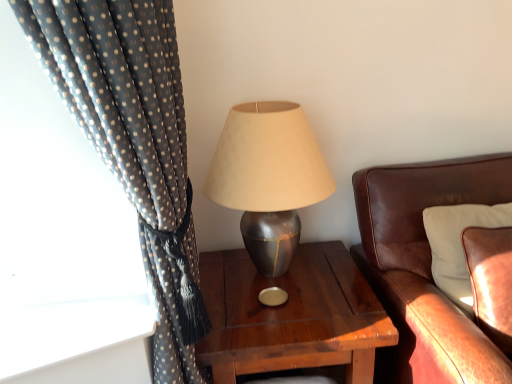
I want to click on polka dot fabric curtain at left, so click(134, 143).

Identify the location of metallic gray lamp at center. This screenshot has width=512, height=384. (268, 178).

From a real-world perspective, does brown leather couch at right sit lower than wooden nightstand at center?

Actually, brown leather couch at right is physically above wooden nightstand at center in the real world.

Based on the photo, from the image's perspective, is brown leather couch at right on top of wooden nightstand at center?

Correct, brown leather couch at right appears higher than wooden nightstand at center in the image.

Does brown leather couch at right have a larger size compared to wooden nightstand at center?

Correct, brown leather couch at right is larger in size than wooden nightstand at center.

Is brown leather couch at right placed right next to wooden nightstand at center?

No, brown leather couch at right is not making contact with wooden nightstand at center.

At what (x,y) coordinates should I click in order to perform the action: click on studio couch in front of the metallic gray lamp at center. Please return your answer as a coordinate pair (x, y). The width and height of the screenshot is (512, 384). Looking at the image, I should click on (425, 268).

Is metallic gray lamp at center in contact with brown leather couch at right?

No, metallic gray lamp at center is not in contact with brown leather couch at right.

From the image's perspective, is metallic gray lamp at center located above brown leather couch at right?

Correct, metallic gray lamp at center appears higher than brown leather couch at right in the image.

Consider the image. Could you tell me if brown leather couch at right is turned towards polka dot fabric curtain at left?

No, brown leather couch at right is not aimed at polka dot fabric curtain at left.

Can you tell me how much brown leather couch at right and polka dot fabric curtain at left differ in facing direction?

2.69 degrees separate the facing orientations of brown leather couch at right and polka dot fabric curtain at left.

Does brown leather couch at right have a larger size compared to polka dot fabric curtain at left?

Yes, brown leather couch at right is bigger than polka dot fabric curtain at left.

Does brown leather couch at right appear on the right side of polka dot fabric curtain at left?

Correct, you'll find brown leather couch at right to the right of polka dot fabric curtain at left.

Is wooden nightstand at center taller or shorter than polka dot fabric curtain at left?

Considering their sizes, wooden nightstand at center has less height than polka dot fabric curtain at left.

At what (x,y) coordinates should I click in order to perform the action: click on nightstand directly beneath the polka dot fabric curtain at left (from a real-world perspective). Please return your answer as a coordinate pair (x, y). This screenshot has height=384, width=512. Looking at the image, I should click on (291, 315).

Is wooden nightstand at center bigger than polka dot fabric curtain at left?

Incorrect, wooden nightstand at center is not larger than polka dot fabric curtain at left.

From the image's perspective, is wooden nightstand at center above or below polka dot fabric curtain at left?

Based on their image positions, wooden nightstand at center is located beneath polka dot fabric curtain at left.

Based on the photo, is leather cushion at right turned away from metallic gray lamp at center?

leather cushion at right does not have its back to metallic gray lamp at center.

Is metallic gray lamp at center inside leather cushion at right?

No, metallic gray lamp at center is not surrounded by leather cushion at right.

Where is `lamp on the left of leather cushion at right`? This screenshot has width=512, height=384. lamp on the left of leather cushion at right is located at coordinates (268, 178).

How much distance is there between leather cushion at right and metallic gray lamp at center?

leather cushion at right is 52.49 centimeters from metallic gray lamp at center.

From the image's perspective, is polka dot fabric curtain at left above brown leather couch at right?

Yes.

Is polka dot fabric curtain at left taller than brown leather couch at right?

Yes, polka dot fabric curtain at left is taller than brown leather couch at right.

Which is closer, (114, 6) or (456, 188)?

The point (114, 6) is more forward.

From a real-world perspective, which object stands above the other?

polka dot fabric curtain at left is physically above.

Are metallic gray lamp at center and leather cushion at right located far from each other?

They are positioned close to each other.

Measure the distance between metallic gray lamp at center and leather cushion at right.

They are 20.66 inches apart.

Does metallic gray lamp at center contain leather cushion at right?

No, metallic gray lamp at center does not contain leather cushion at right.

From the picture: Could you tell me if metallic gray lamp at center is facing leather cushion at right?

No.

This screenshot has height=384, width=512. What are the coordinates of `nightstand located on the left of brown leather couch at right` in the screenshot? It's located at (291, 315).

Locate an element on the screen. This screenshot has width=512, height=384. lamp above the brown leather couch at right (from a real-world perspective) is located at coordinates [268, 178].

Based on their spatial positions, is leather cushion at right or wooden nightstand at center further from brown leather couch at right?

Among the two, wooden nightstand at center is located further to brown leather couch at right.

Considering their positions, is leather cushion at right positioned closer to brown leather couch at right than polka dot fabric curtain at left?

Based on the image, leather cushion at right appears to be nearer to brown leather couch at right.

Considering their positions, is leather cushion at right positioned further to metallic gray lamp at center than brown leather couch at right?

leather cushion at right lies further to metallic gray lamp at center than the other object.

Which object lies nearer to the anchor point polka dot fabric curtain at left, leather cushion at right or brown leather couch at right?

The object closer to polka dot fabric curtain at left is brown leather couch at right.

Based on their spatial positions, is metallic gray lamp at center or polka dot fabric curtain at left closer to leather cushion at right?

Based on the image, metallic gray lamp at center appears to be nearer to leather cushion at right.

Which object lies further to the anchor point polka dot fabric curtain at left, brown leather couch at right or wooden nightstand at center?

brown leather couch at right is further to polka dot fabric curtain at left.

Considering their positions, is metallic gray lamp at center positioned further to brown leather couch at right than polka dot fabric curtain at left?

Based on the image, polka dot fabric curtain at left appears to be further to brown leather couch at right.

From the picture: Looking at the image, which one is located closer to polka dot fabric curtain at left, wooden nightstand at center or brown leather couch at right?

wooden nightstand at center is closer to polka dot fabric curtain at left.

Find the location of a particular element. lamp between polka dot fabric curtain at left and wooden nightstand at center along the z-axis is located at coordinates (268, 178).

This screenshot has height=384, width=512. I want to click on nightstand situated between metallic gray lamp at center and brown leather couch at right from left to right, so click(291, 315).

This screenshot has height=384, width=512. In order to click on pillow between metallic gray lamp at center and brown leather couch at right from left to right in this screenshot , I will do `click(458, 244)`.

At what (x,y) coordinates should I click in order to perform the action: click on lamp between polka dot fabric curtain at left and brown leather couch at right from left to right. Please return your answer as a coordinate pair (x, y). Looking at the image, I should click on (268, 178).